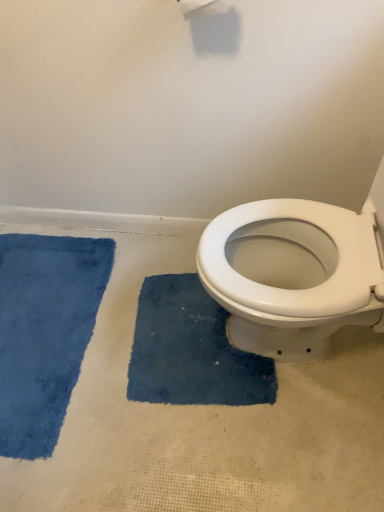
Identify the location of free area in between blue plush bath mat at left, placed as the second bath mat when sorted from right to left, and blue plush bath mat at center, the first bath mat positioned from the right. (120, 372).